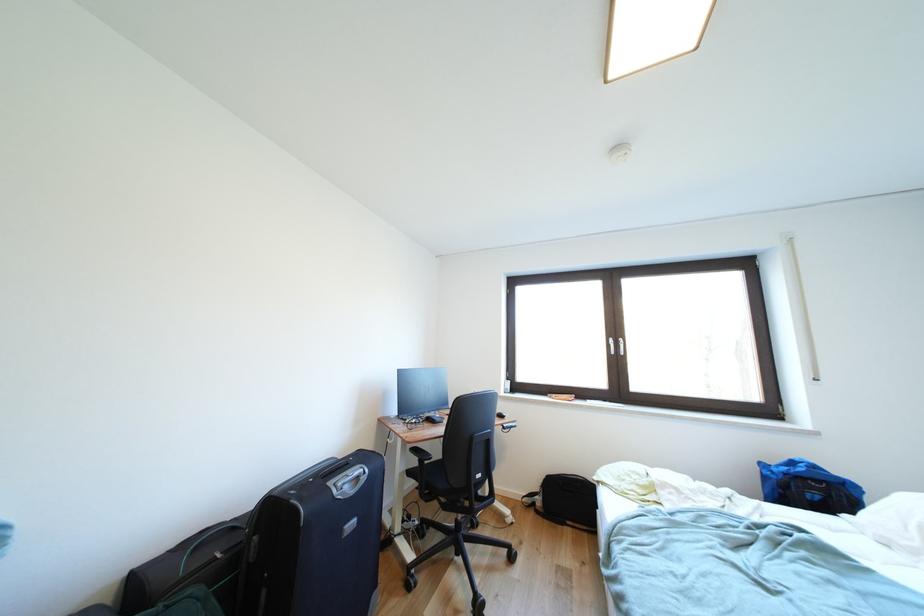
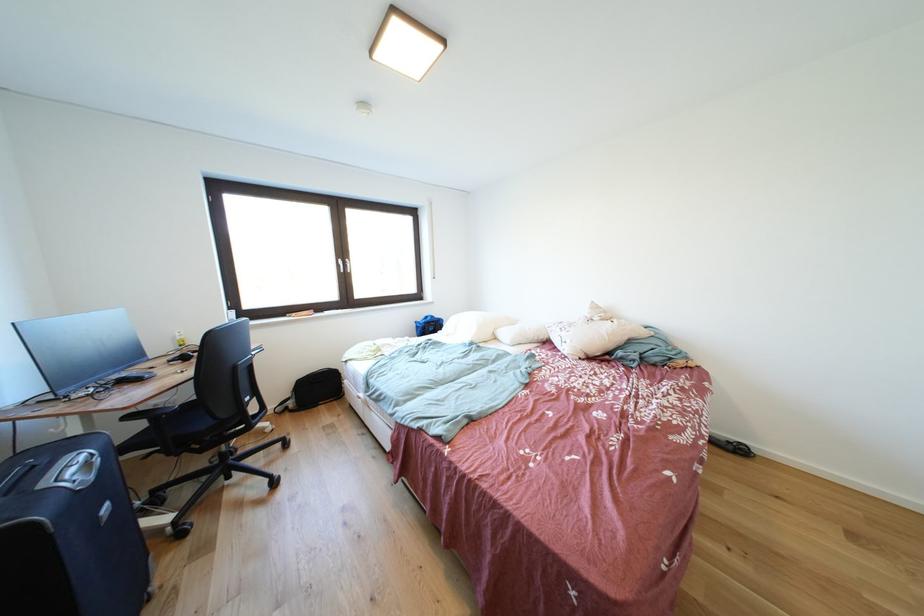
The point at [619,345] is marked in the first image. Where is the corresponding point in the second image?

(348, 265)